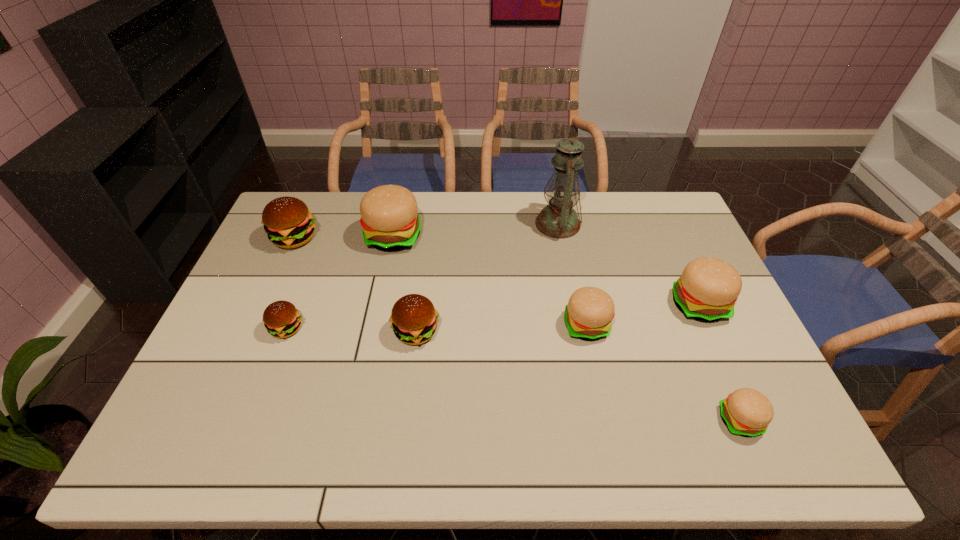
This screenshot has width=960, height=540. Find the location of `object that is at the near edge`. object that is at the near edge is located at coordinates (747, 412).

The height and width of the screenshot is (540, 960). Find the location of `object at the far left corner`. object at the far left corner is located at coordinates (288, 223).

At what (x,y) coordinates should I click in order to perform the action: click on object present at the near right corner. Please return your answer as a coordinate pair (x, y). The width and height of the screenshot is (960, 540). Looking at the image, I should click on (747, 412).

Where is `free space at the far edge of the desktop`? This screenshot has width=960, height=540. free space at the far edge of the desktop is located at coordinates (534, 215).

Locate an element on the screen. free space at the near edge of the desktop is located at coordinates (264, 434).

Identify the location of vacant space at the left edge of the desktop. (301, 272).

Where is `free region at the right edge`? This screenshot has height=540, width=960. free region at the right edge is located at coordinates (697, 325).

Locate an element on the screen. The width and height of the screenshot is (960, 540). free space between the nearest beige hamburger and the biggest brown hamburger is located at coordinates (517, 329).

Identify the location of free point between the oil lamp and the third biggest beige hamburger. The height and width of the screenshot is (540, 960). (572, 275).

The width and height of the screenshot is (960, 540). Find the location of `free spot between the second biggest brown hamburger and the farthest beige hamburger`. free spot between the second biggest brown hamburger and the farthest beige hamburger is located at coordinates (405, 284).